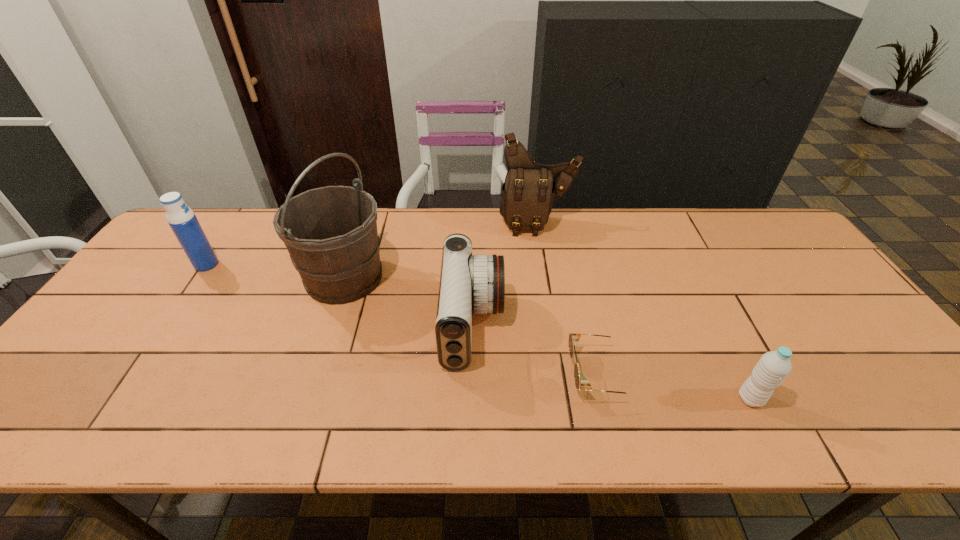
Locate an element on the screen. vacant area located on the right of the second object from left to right is located at coordinates (434, 278).

The image size is (960, 540). In order to click on free region located on the front-facing side of the fifth shortest object in this screenshot , I will do `click(551, 309)`.

Where is `vacant region located on the back of the fourth shortest object`? vacant region located on the back of the fourth shortest object is located at coordinates (220, 245).

Locate an element on the screen. The image size is (960, 540). vacant space positioned on the surface of the camcorder is located at coordinates (639, 325).

Identify the location of vacant space located on the right of the rightmost object. The height and width of the screenshot is (540, 960). (827, 399).

Where is `free location located 0.300m on the front lenses of the shortest object`? The width and height of the screenshot is (960, 540). free location located 0.300m on the front lenses of the shortest object is located at coordinates (442, 374).

Locate an element on the screen. free spot located 0.320m on the front lenses of the shortest object is located at coordinates (433, 374).

Locate an element on the screen. This screenshot has height=540, width=960. vacant space positioned on the front lenses of the shortest object is located at coordinates (489, 374).

In order to click on bucket present at the far edge in this screenshot , I will do `click(330, 232)`.

Locate an element on the screen. The image size is (960, 540). shoulder bag at the far edge is located at coordinates (527, 195).